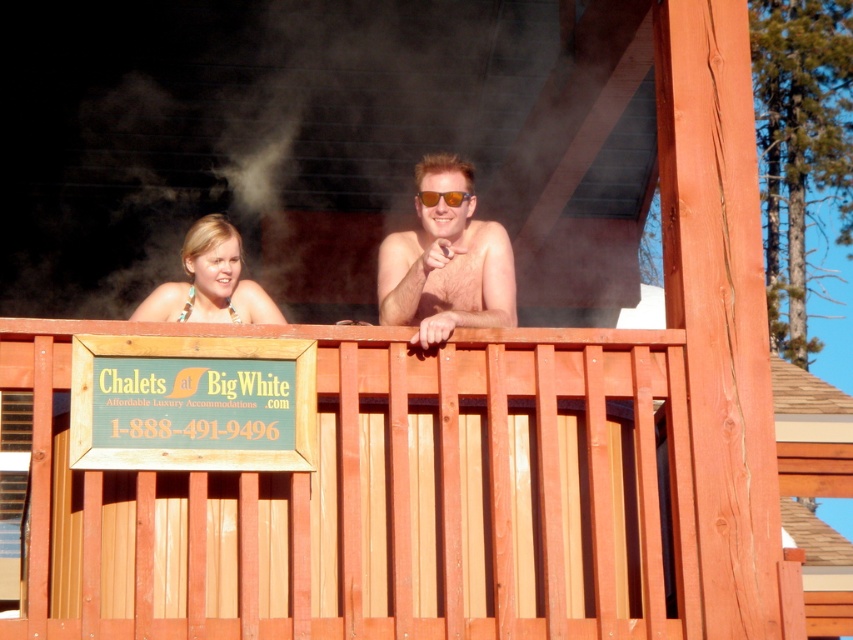
Find the location of a particular element. This screenshot has height=640, width=853. wooden slats at center is located at coordinates (431, 499).

Who is more distant from viewer, (511, 541) or (428, 326)?

The point (428, 326) is behind.

Locate an element on the screen. wooden slats at center is located at coordinates (431, 499).

In order to click on wooden slats at center in this screenshot , I will do `click(431, 499)`.

Can you confirm if wooden slats at center is shorter than matte gold necklace at upper left?

No, wooden slats at center is not shorter than matte gold necklace at upper left.

Is point (144, 634) less distant than point (228, 227)?

Yes.

In order to click on wooden slats at center in this screenshot , I will do `click(431, 499)`.

In order to click on matte skin couple at center in this screenshot , I will do `click(445, 260)`.

Is matte skin couple at center below matte gold necklace at upper left?

Indeed, matte skin couple at center is positioned under matte gold necklace at upper left.

The image size is (853, 640). What do you see at coordinates (445, 260) in the screenshot?
I see `matte skin couple at center` at bounding box center [445, 260].

At what (x,y) coordinates should I click in order to perform the action: click on matte skin couple at center. Please return your answer as a coordinate pair (x, y). This screenshot has height=640, width=853. Looking at the image, I should click on (445, 260).